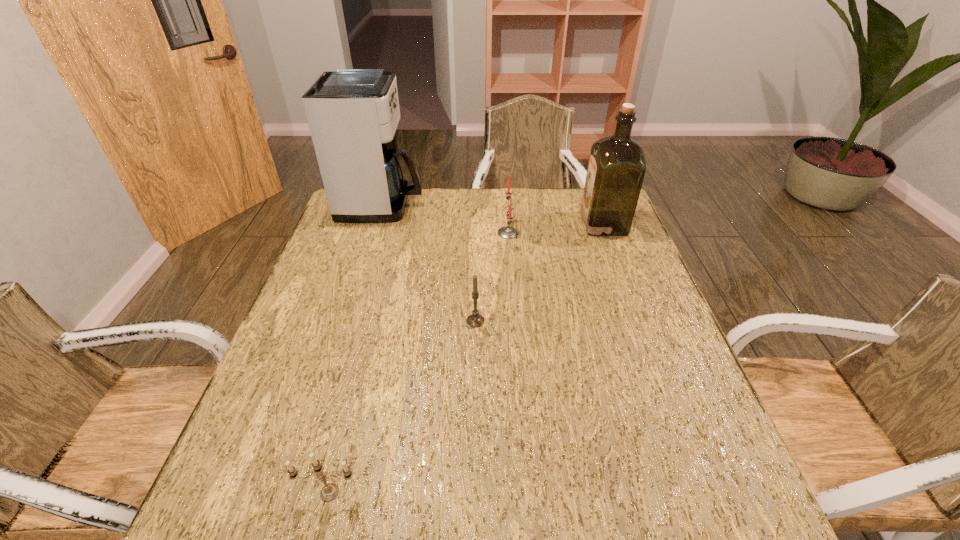
Find the location of `object located at the near edge`. object located at the near edge is located at coordinates (330, 491).

This screenshot has height=540, width=960. I want to click on coffee maker at the left edge, so tap(353, 114).

Image resolution: width=960 pixels, height=540 pixels. I want to click on candle located at the left edge, so click(x=330, y=491).

Identify the location of object that is at the right edge. The height and width of the screenshot is (540, 960). click(x=616, y=169).

The image size is (960, 540). What are the coordinates of `object that is at the far left corner` in the screenshot? It's located at (353, 114).

Where is `object that is at the near left corner`? This screenshot has width=960, height=540. object that is at the near left corner is located at coordinates (330, 491).

You are a GUI agent. You are given a task and a screenshot of the screen. Output one action in this format:
    pyautogui.click(x=<x>, y=<y>)
    Task: Click on the object that is at the far right corner
    
    Given the screenshot: What is the action you would take?
    coord(616,169)

At what (x,y) coordinates should I click in order to perform the action: click on vacant space at the far edge of the desktop. Please return your answer as a coordinate pair (x, y). Looking at the image, I should click on (429, 193).

The height and width of the screenshot is (540, 960). Identify the location of free space at the left edge. (289, 422).

Identify the location of vacant space at the right edge of the desktop. (711, 487).